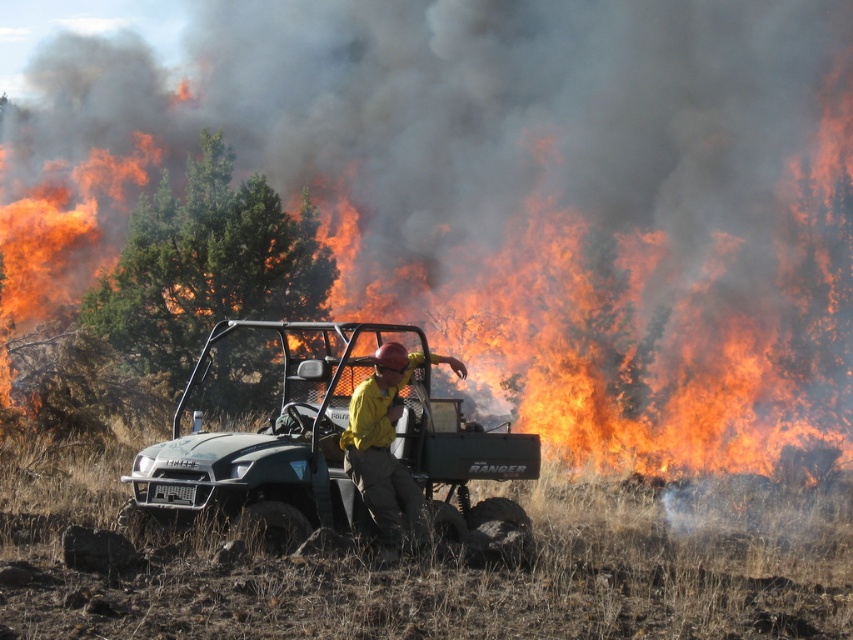
Describe the element at coordinates (339, 449) in the screenshot. I see `green matte utility vehicle at center` at that location.

Does green matte utility vehicle at center come behind yellow fire-resistant suit at center?

That is True.

Is point (383, 324) farther from viewer compared to point (384, 454)?

That is True.

The width and height of the screenshot is (853, 640). I want to click on green matte utility vehicle at center, so click(339, 449).